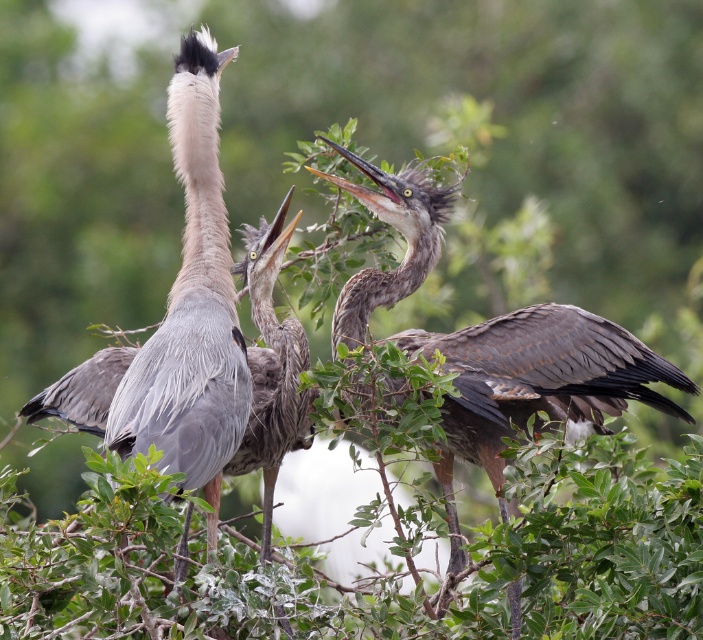
Is point (501, 500) farther from camera compared to point (167, 116)?

No, it is not.

Does gray feathered heron at center have a lesser width compared to gray feathered heron at left?

No.

Where is `gray feathered heron at center`? gray feathered heron at center is located at coordinates (534, 385).